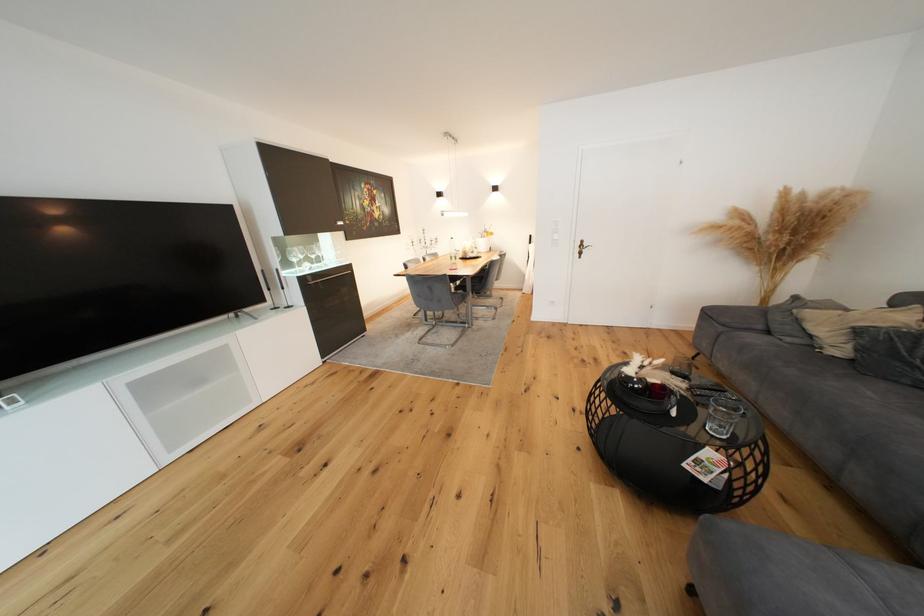
What do you see at coordinates (870, 444) in the screenshot? This screenshot has width=924, height=616. I see `the grey sofa sitting surface` at bounding box center [870, 444].